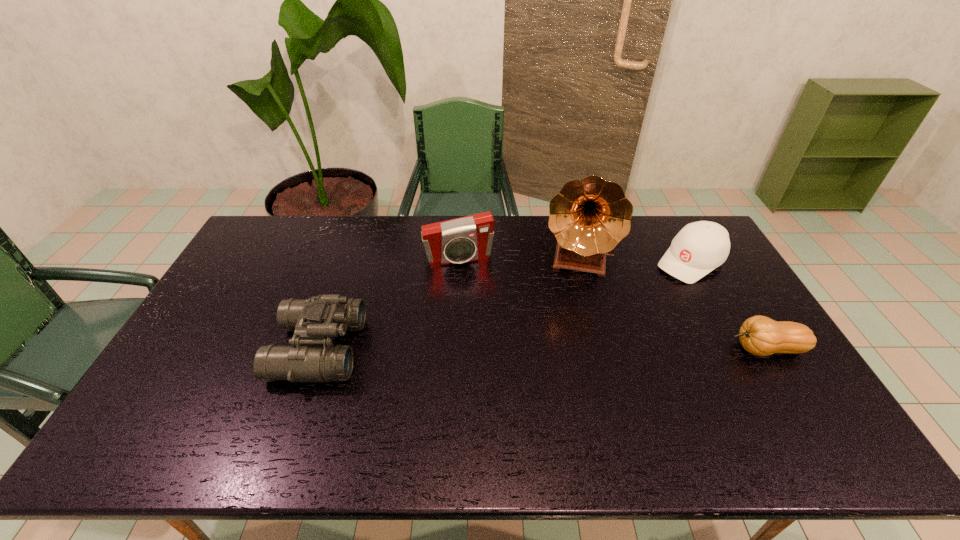
At what (x,y) coordinates should I click in order to perform the action: click on baseball cap that is at the far edge. Please return your answer as a coordinate pair (x, y). The image size is (960, 540). Looking at the image, I should click on (700, 247).

Identify the location of camera positioned at the far edge. (469, 238).

Find the location of a particular element. This screenshot has width=960, height=540. object that is at the near edge is located at coordinates (312, 357).

Identify the location of gourd located at the right edge. (759, 335).

Locate an element on the screen. The width and height of the screenshot is (960, 540). baseball cap that is at the right edge is located at coordinates (700, 247).

This screenshot has height=540, width=960. Identify the location of object positioned at the far right corner. (700, 247).

Where is `vacant space at the far edge of the desktop`? Image resolution: width=960 pixels, height=540 pixels. vacant space at the far edge of the desktop is located at coordinates (391, 236).

Locate an element on the screen. The height and width of the screenshot is (540, 960). free space at the far left corner of the desktop is located at coordinates (265, 218).

Image resolution: width=960 pixels, height=540 pixels. In order to click on vacant space at the near left corner in this screenshot , I will do `click(170, 403)`.

Identify the location of empty space between the second shortest object and the shortest object. The height and width of the screenshot is (540, 960). (728, 305).